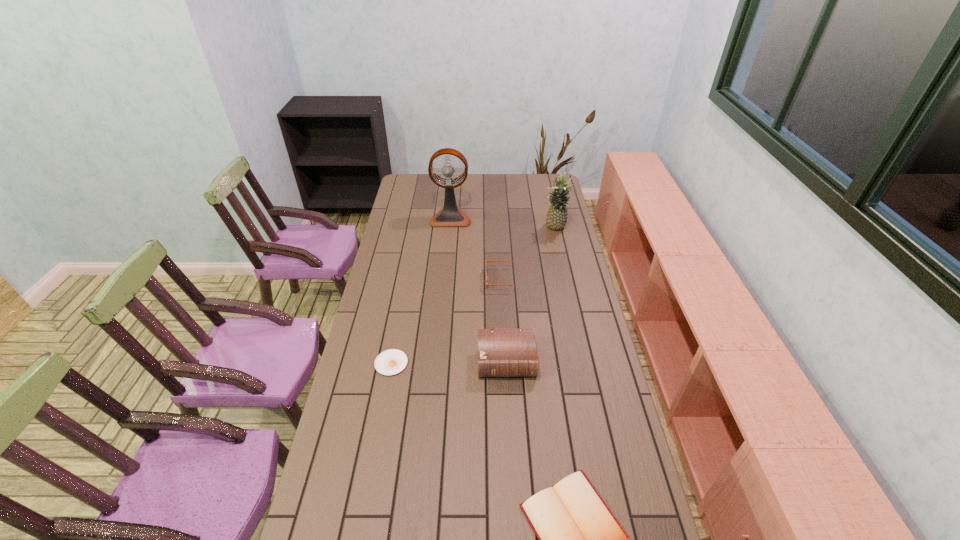
You are a GUI agent. You are given a task and a screenshot of the screen. Output one action in this format:
    pyautogui.click(x=<x>, y=<y>)
    Task: Click on the free region at the right edge of the desktop
    Image resolution: width=960 pixels, height=540 pixels.
    Given the screenshot: What is the action you would take?
    pyautogui.click(x=571, y=230)

What are the coordinates of `free space at the far left corner of the desktop` in the screenshot? It's located at (398, 194).

Where is `vacant region at the far right corner of the desktop`? vacant region at the far right corner of the desktop is located at coordinates (532, 188).

Image resolution: width=960 pixels, height=540 pixels. I want to click on vacant space that's between the fan and the pineapple, so click(x=503, y=223).

Identify the location of unoccupied area between the sunglasses and the fan. (477, 248).

Where is `free space between the leftmost object and the fan`? This screenshot has height=540, width=960. free space between the leftmost object and the fan is located at coordinates (420, 291).

Locate an element on the screen. This screenshot has width=960, height=540. empty space that is in between the farther Bible and the egg yolk is located at coordinates (449, 362).

Image resolution: width=960 pixels, height=540 pixels. I want to click on free space between the farther Bible and the pineapple, so click(x=531, y=295).

In order to click on object that is the fifth nearest to the shortest object in this screenshot , I will do `click(556, 218)`.

The width and height of the screenshot is (960, 540). In order to click on object that stands as the closest to the second shortest object in this screenshot , I will do `click(512, 352)`.